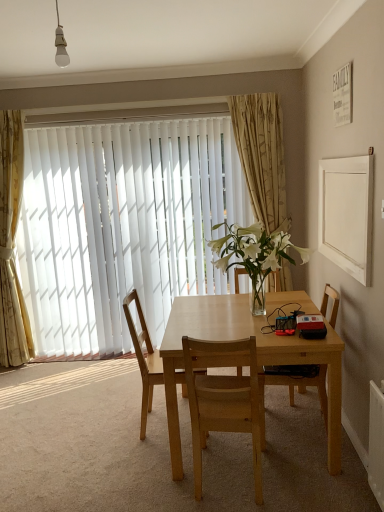
This screenshot has width=384, height=512. Find the location of `vacant space in between light brown wood chair at center, the second chair from the left, and light wood table at center`. vacant space in between light brown wood chair at center, the second chair from the left, and light wood table at center is located at coordinates (281, 488).